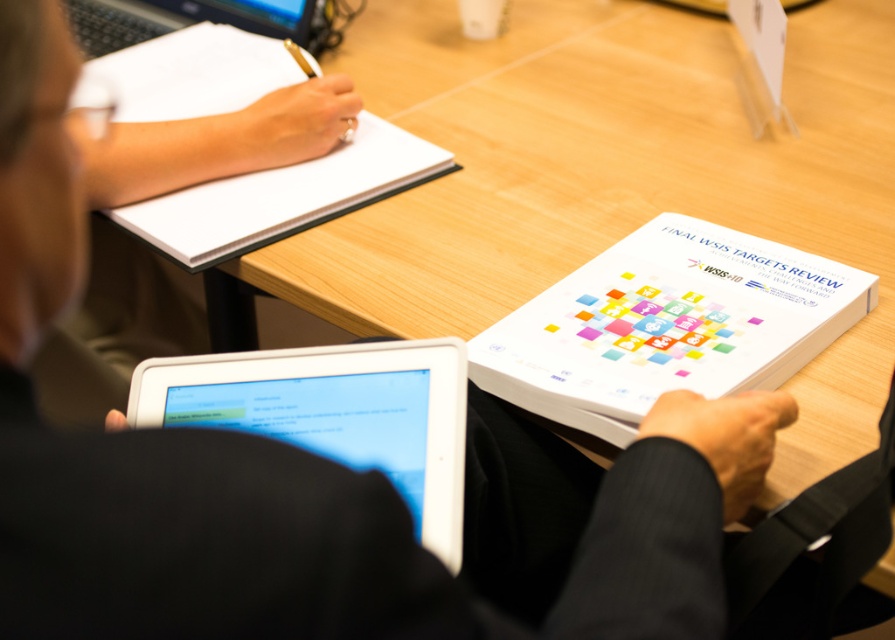
Question: Is white paper at upper left further to the viewer compared to black plastic laptop at upper left?

Choices:
 (A) no
 (B) yes

Answer: (A)

Question: Which object is the closest to the white glossy tablet at lower left?

Choices:
 (A) white paper at upper left
 (B) white paper at center
 (C) black plastic laptop at upper left

Answer: (B)

Question: Can you confirm if white paper at center is bigger than black plastic laptop at upper left?

Choices:
 (A) yes
 (B) no

Answer: (A)

Question: Does white paper at upper left appear on the right side of black plastic laptop at upper left?

Choices:
 (A) yes
 (B) no

Answer: (A)

Question: Which of the following is the closest to the observer?

Choices:
 (A) (735, 321)
 (B) (142, 26)

Answer: (A)

Question: Among these points, which one is nearest to the camera?

Choices:
 (A) (116, 44)
 (B) (391, 141)
 (C) (514, 371)

Answer: (C)